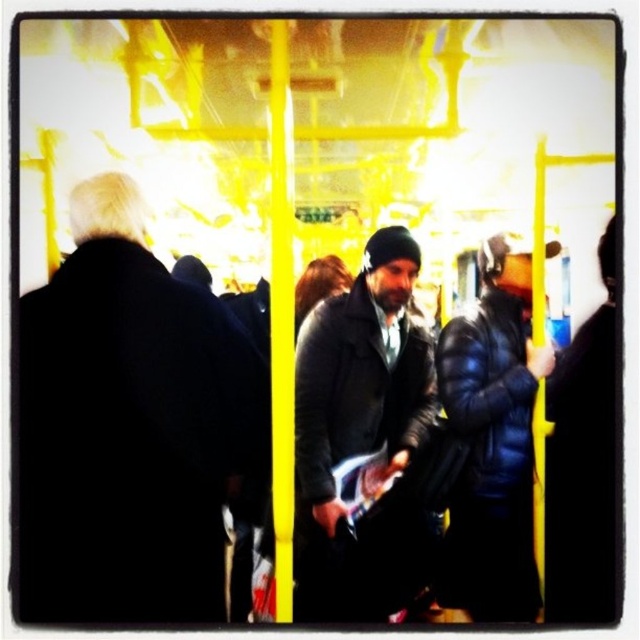
Which of these two, dark gray leather jacket at center or dark blue puffy jacket at center, stands taller?

dark blue puffy jacket at center is taller.

The image size is (640, 640). In order to click on dark gray leather jacket at center in this screenshot , I will do `click(362, 435)`.

Image resolution: width=640 pixels, height=640 pixels. Find the location of `dark gray leather jacket at center`. dark gray leather jacket at center is located at coordinates (362, 435).

Find the location of `dark gray leather jacket at center`. dark gray leather jacket at center is located at coordinates (362, 435).

Is point (316, 396) closer to camera compared to point (490, 460)?

No.

Identify the location of dark gray leather jacket at center. (362, 435).

Is point (132, 266) in front of point (477, 451)?

That is True.

Who is higher up, black matte coat at left or matte black jacket at center?

black matte coat at left is higher up.

Measure the distance between black matte coat at left and camera.

black matte coat at left and camera are 1.51 meters apart from each other.

The image size is (640, 640). In order to click on black matte coat at left in this screenshot , I will do `click(131, 426)`.